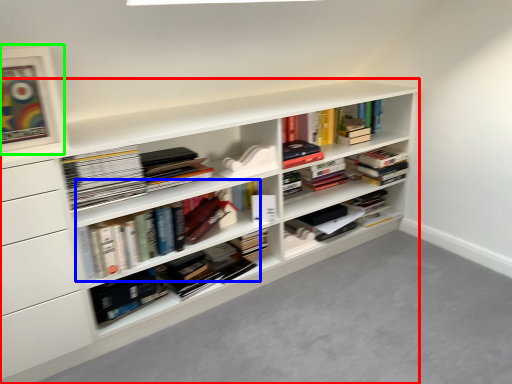
Question: Which object is positioned closest to shelf (highlighted by a red box)? Select from book (highlighted by a blue box) and picture frame (highlighted by a green box).

Choices:
 (A) book
 (B) picture frame

Answer: (A)